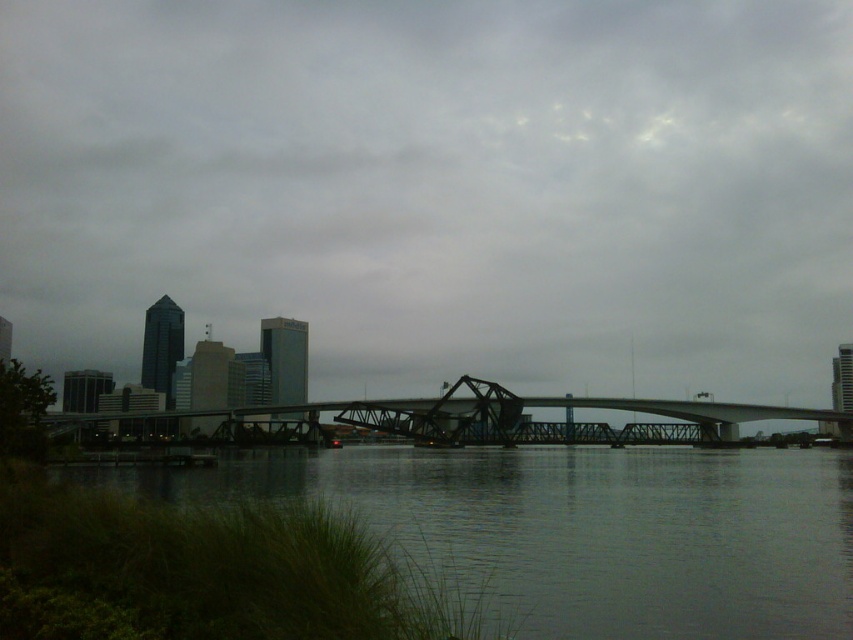
Can you confirm if matte gray bridge at center is shorter than steel bridge at center?

Incorrect, matte gray bridge at center's height does not fall short of steel bridge at center's.

Does matte gray bridge at center have a lesser width compared to steel bridge at center?

No, matte gray bridge at center is not thinner than steel bridge at center.

Measure the distance between point (578, 116) and camera.

The distance of point (578, 116) from camera is 469.75 meters.

Locate an element on the screen. This screenshot has height=640, width=853. matte gray bridge at center is located at coordinates (438, 188).

Identify the location of dark water at lower left. (577, 531).

Can you confirm if dark water at lower left is wider than steel bridge at center?

In fact, dark water at lower left might be narrower than steel bridge at center.

Does point (566, 579) come behind point (460, 419)?

No.

Identify the location of dark water at lower left. (577, 531).

Looking at this image, which is below, matte gray bridge at center or dark water at lower left?

dark water at lower left

Who is more forward, (215, 92) or (668, 632)?

Positioned in front is point (668, 632).

Which is behind, point (387, 83) or point (759, 449)?

Positioned behind is point (387, 83).

Identify the location of matte gray bridge at center. This screenshot has height=640, width=853. (438, 188).